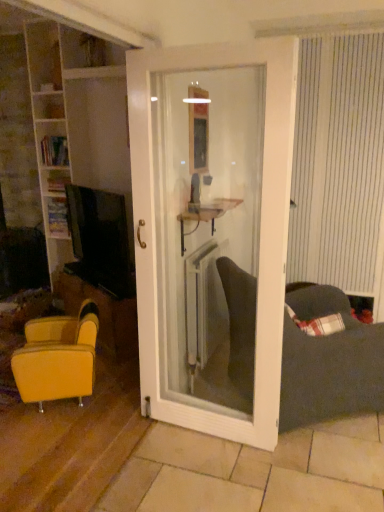
The width and height of the screenshot is (384, 512). What do you see at coordinates (58, 357) in the screenshot? I see `leather-like yellow armchair at lower left` at bounding box center [58, 357].

Where is `wooden bookshelf at left`? The image size is (384, 512). wooden bookshelf at left is located at coordinates (58, 217).

In order to face matte white shelf at center, the first table in the right-to-left sequence, should I rotate leftwards or rightwards?

To align with it, rotate right about 2.965°.

Describe the element at coordinates (198, 304) in the screenshot. I see `white metallic radiator at center` at that location.

What are the coordinates of `leather-like yellow armchair at lower left` in the screenshot? It's located at (58, 357).

From a real-world perspective, between matte white shelf at center, acting as the 1th table starting from the front, and white metallic radiator at center, who is vertically lower?

white metallic radiator at center, from a real-world perspective.

From the image's perspective, is matte white shelf at center, the 1th table when ordered from top to bottom, above or below white metallic radiator at center?

matte white shelf at center, the 1th table when ordered from top to bottom, is above white metallic radiator at center.

Considering the positions of point (200, 221) and point (197, 322), is point (200, 221) closer or farther from the camera than point (197, 322)?

Point (200, 221) appears to be closer to the viewer than point (197, 322).

Which object is positioned more to the right, white striped curtain at right or dark gray fabric couch at lower right?

white striped curtain at right is more to the right.

Could you tell me if white striped curtain at right is facing dark gray fabric couch at lower right?

A: Yes, white striped curtain at right is aimed at dark gray fabric couch at lower right.

From a real-world perspective, is white striped curtain at right located beneath dark gray fabric couch at lower right?

Incorrect, from a real-world perspective, white striped curtain at right is higher than dark gray fabric couch at lower right.

Does point (308, 419) lie behind point (209, 255)?

No, (308, 419) is closer to viewer.

From the image's perspective, which one is positioned higher, dark gray fabric couch at lower right or white metallic radiator at center?

white metallic radiator at center is shown above in the image.

Is dark gray fabric couch at lower right aimed at white metallic radiator at center?

No, dark gray fabric couch at lower right is not aimed at white metallic radiator at center.

Who is shorter, dark gray fabric couch at lower right or white metallic radiator at center?

white metallic radiator at center.

Between white wooden door at center and white metallic radiator at center, which one appears on the left side from the viewer's perspective?

white wooden door at center.

Are white wooden door at center and white metallic radiator at center beside each other?

white wooden door at center is not next to white metallic radiator at center, and they're not touching.

Which object is wider, white wooden door at center or white metallic radiator at center?

With larger width is white wooden door at center.

Is yellow leather chair at left, which is counted as the 2th table, starting from the top, located outside white striped curtain at right?

Yes, yellow leather chair at left, which is counted as the 2th table, starting from the top, is not within white striped curtain at right.

Looking at their sizes, would you say yellow leather chair at left, the 1th table viewed from the back, is wider or thinner than white striped curtain at right?

yellow leather chair at left, the 1th table viewed from the back, is wider than white striped curtain at right.

Where is `curtain that is above the yellow leather chair at left, which is the first table in left-to-right order (from a real-world perspective)`? The width and height of the screenshot is (384, 512). curtain that is above the yellow leather chair at left, which is the first table in left-to-right order (from a real-world perspective) is located at coordinates (338, 162).

Is white wood bookshelf at left at the left side of white striped curtain at right?

Yes, white wood bookshelf at left is to the left of white striped curtain at right.

Considering the positions of objects white wood bookshelf at left and white striped curtain at right in the image provided, who is in front, white wood bookshelf at left or white striped curtain at right?

Positioned in front is white striped curtain at right.

Which is farther, [127,207] or [299,104]?

The point [299,104] is farther.

Which of these two, leather-like yellow armchair at lower left or wooden bookshelf at left, is wider?

Wider between the two is leather-like yellow armchair at lower left.

Is leather-like yellow armchair at lower left situated inside wooden bookshelf at left or outside?

leather-like yellow armchair at lower left cannot be found inside wooden bookshelf at left.

Which is closer to the camera, (55, 391) or (49, 204)?

The point (55, 391) is closer.

Considering the positions of objects leather-like yellow armchair at lower left and wooden bookshelf at left in the image provided, who is in front, leather-like yellow armchair at lower left or wooden bookshelf at left?

leather-like yellow armchair at lower left is more forward.

This screenshot has height=512, width=384. I want to click on radiator that appears below the matte white shelf at center, arranged as the 2th table when viewed from the back (from a real-world perspective), so click(x=198, y=304).

You are a GUI agent. You are given a task and a screenshot of the screen. Output one action in this format:
    pyautogui.click(x=<x>, y=<y>)
    Task: Click on the studio couch on the left of white striped curtain at right
    Image resolution: width=384 pixels, height=512 pixels.
    Given the screenshot: What is the action you would take?
    pyautogui.click(x=329, y=364)

Looking at the image, which one is located closer to wooden bookshelf at left, white metallic radiator at center or white striped curtain at right?

Among the two, white metallic radiator at center is located nearer to wooden bookshelf at left.

Considering their positions, is matte white shelf at center, acting as the 1th table starting from the front, positioned closer to white wooden door at center than white metallic radiator at center?

white metallic radiator at center is positioned closer to the anchor white wooden door at center.

Looking at the image, which one is located closer to white wooden door at center, white striped curtain at right or leather-like yellow armchair at lower left?

Among the two, leather-like yellow armchair at lower left is located nearer to white wooden door at center.

Which object lies further to the anchor point leather-like yellow armchair at lower left, white wood bookshelf at left or white wooden door at center?

The object further to leather-like yellow armchair at lower left is white wood bookshelf at left.

When comparing their distances from white striped curtain at right, does leather-like yellow armchair at lower left or white wood bookshelf at left seem closer?

white wood bookshelf at left is positioned closer to the anchor white striped curtain at right.

Which object lies further to the anchor point dark gray fabric couch at lower right, leather-like yellow armchair at lower left or white striped curtain at right?

leather-like yellow armchair at lower left is positioned further to the anchor dark gray fabric couch at lower right.

Considering their positions, is matte white shelf at center, acting as the 1th table starting from the front, positioned closer to white wood bookshelf at left than white wooden door at center?

matte white shelf at center, acting as the 1th table starting from the front, lies closer to white wood bookshelf at left than the other object.

When comparing their distances from dark gray fabric couch at lower right, does white wooden door at center or yellow leather chair at left, marked as the second table in a right-to-left arrangement, seem further?

yellow leather chair at left, marked as the second table in a right-to-left arrangement, lies further to dark gray fabric couch at lower right than the other object.

Find the location of `radiator situated between leather-like yellow armchair at lower left and matte white shelf at center, the first table in the right-to-left sequence, from left to right`. radiator situated between leather-like yellow armchair at lower left and matte white shelf at center, the first table in the right-to-left sequence, from left to right is located at coordinates (198, 304).

I want to click on cabinetry between leather-like yellow armchair at lower left and wooden bookshelf at left in the front-back direction, so (x=78, y=119).

This screenshot has width=384, height=512. In order to click on radiator between white wood bookshelf at left and white striped curtain at right in the horizontal direction in this screenshot , I will do `click(198, 304)`.

Where is `studio couch between white wooden door at center and white striped curtain at right from front to back`? The height and width of the screenshot is (512, 384). studio couch between white wooden door at center and white striped curtain at right from front to back is located at coordinates click(329, 364).